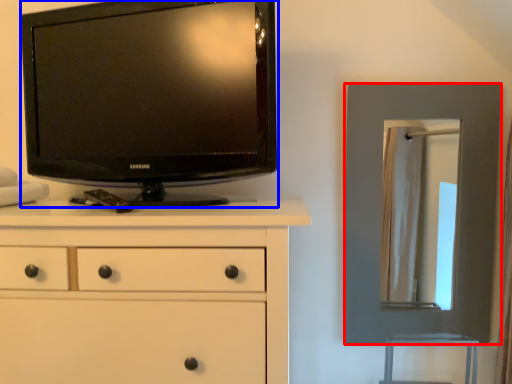
Question: Which object appears farthest to the camera in this image, picture frame (highlighted by a red box) or television (highlighted by a blue box)?

Choices:
 (A) picture frame
 (B) television

Answer: (A)